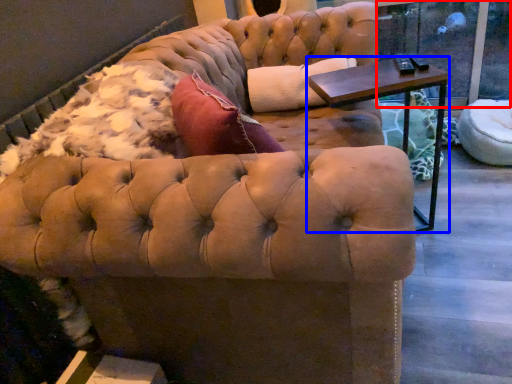
Question: Which of the following is the closest to the observer, window screen (highlighted by a red box) or table (highlighted by a blue box)?

Choices:
 (A) window screen
 (B) table

Answer: (B)